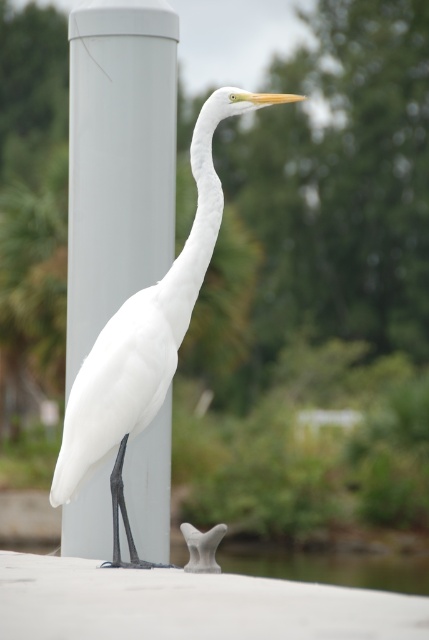
Is white smooth pole at center shorter than white matte bird at center?

Correct, white smooth pole at center is not as tall as white matte bird at center.

Is white smooth pole at center above white matte bird at center?

Yes.

The image size is (429, 640). Find the location of `white smooth pole at center`. white smooth pole at center is located at coordinates (117, 160).

You are a GUI agent. You are given a task and a screenshot of the screen. Output one action in this format:
    pyautogui.click(x=<x>, y=<y>)
    Task: Click on the white smooth pole at center
    
    Given the screenshot: What is the action you would take?
    pyautogui.click(x=117, y=160)